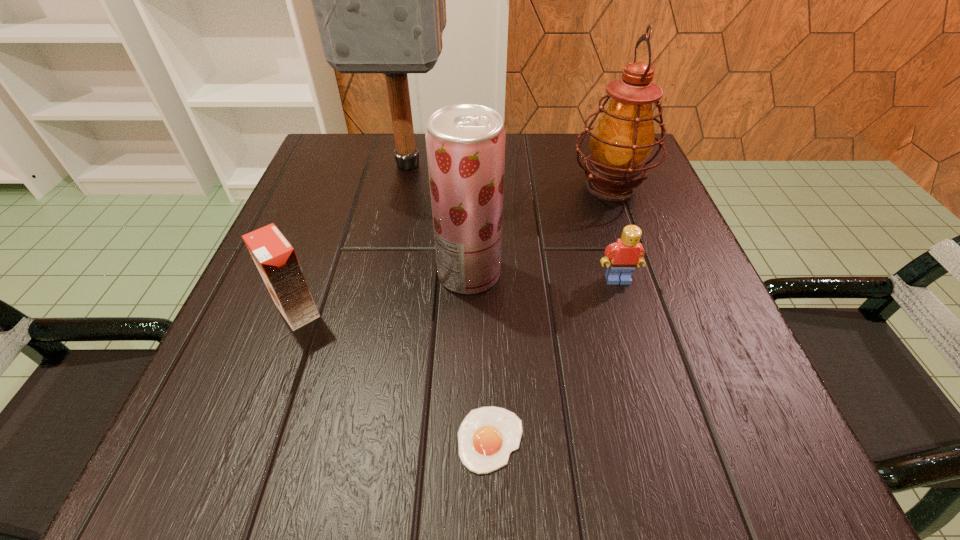
Find the location of a particular element. The height and width of the screenshot is (540, 960). object located in the far left corner section of the desktop is located at coordinates (379, 0).

Identify the location of object that is at the far right corner. (622, 140).

This screenshot has width=960, height=540. I want to click on vacant point at the far edge, so click(x=550, y=165).

In the image, there is a desktop. Identify the location of free space at the near edge. This screenshot has width=960, height=540. (410, 426).

Where is `free space at the left edge`? The image size is (960, 540). free space at the left edge is located at coordinates (297, 200).

Find the location of a particular element. Image resolution: width=960 pixels, height=540 pixels. vacant area at the right edge is located at coordinates (685, 340).

In order to click on free space at the far left corner of the desktop in this screenshot , I will do tap(356, 156).

Locate an element on the screen. vacant space at the near left corner of the desktop is located at coordinates (225, 463).

This screenshot has width=960, height=540. Find the location of `empty space between the nearest object and the third shortest object`. empty space between the nearest object and the third shortest object is located at coordinates (394, 375).

Where is `free space between the oil lamp and the second shortest object`? This screenshot has width=960, height=540. free space between the oil lamp and the second shortest object is located at coordinates (614, 233).